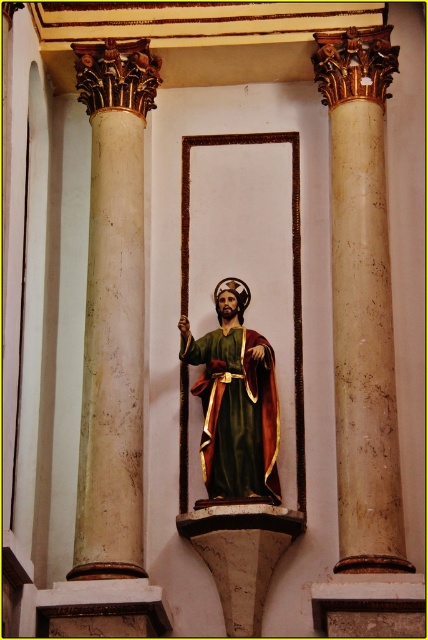
Question: Which point appears closest to the camera in this image?

Choices:
 (A) (321, 61)
 (B) (86, 428)

Answer: (B)

Question: Is beige marble column at right further to camera compared to green velvet robe at center?

Choices:
 (A) no
 (B) yes

Answer: (A)

Question: Is the position of beige marble column at right less distant than that of beige marble column at left?

Choices:
 (A) no
 (B) yes

Answer: (B)

Question: Estimate the real-world distances between objects in this image. Which object is closer to the beige marble column at right?

Choices:
 (A) green velvet robe at center
 (B) beige marble column at left

Answer: (B)

Question: Considering the real-world distances, which object is farthest from the beige marble column at right?

Choices:
 (A) beige marble column at left
 (B) green velvet robe at center

Answer: (B)

Question: Is beige marble column at right positioned in front of green velvet robe at center?

Choices:
 (A) no
 (B) yes

Answer: (B)